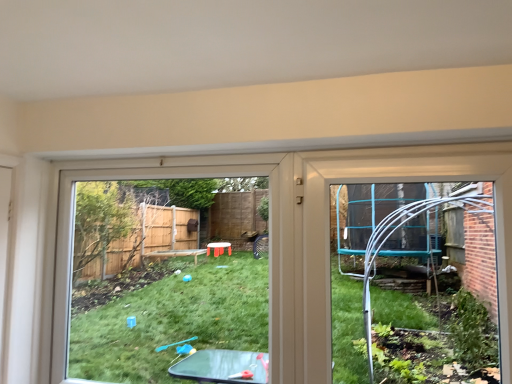
Question: From the image's perspective, is transparent plastic table at center located above or below clear plastic trampoline at right?

Choices:
 (A) below
 (B) above

Answer: (A)

Question: Does point (274, 241) appear closer or farther from the camera than point (338, 173)?

Choices:
 (A) closer
 (B) farther

Answer: (B)

Question: Is transparent plastic table at center to the left or to the right of clear plastic trampoline at right in the image?

Choices:
 (A) left
 (B) right

Answer: (A)

Question: Is clear plastic trampoline at right spatially inside transparent plastic table at center, or outside of it?

Choices:
 (A) inside
 (B) outside

Answer: (B)

Question: Considering the positions of point (502, 170) and point (60, 223), is point (502, 170) closer or farther from the camera than point (60, 223)?

Choices:
 (A) farther
 (B) closer

Answer: (B)

Question: From a real-world perspective, relative to transparent plastic table at center, is clear plastic trampoline at right vertically above or below?

Choices:
 (A) below
 (B) above

Answer: (B)

Question: In terms of size, does clear plastic trampoline at right appear bigger or smaller than transparent plastic table at center?

Choices:
 (A) big
 (B) small

Answer: (B)